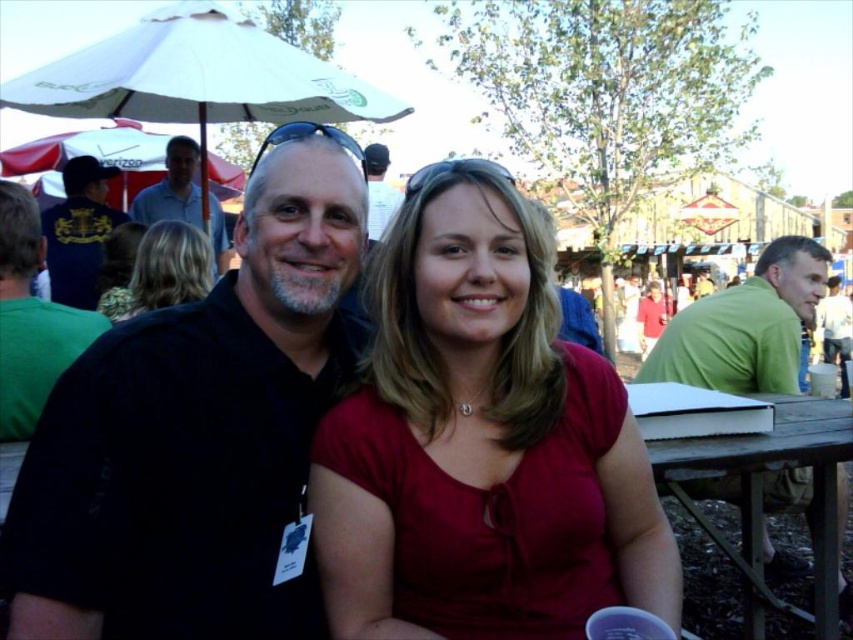
From the picture: You are at a community event and see two people in the distance. One is wearing a light blue shirt at upper left and the other is wearing a matte black shirt at center. Which one is positioned more to the left side of the scene?

The light blue shirt at upper left is positioned more to the left side of the scene compared to the matte black shirt at center.

You are organizing a photo shoot and need to place two models in the scene. The first model is wearing a light blue shirt at upper left, and the second is wearing a matte black shirt at center. If you want to ensure both models are visible in the frame, which model should you position closer to the camera to maintain their visibility?

The light blue shirt at upper left should be positioned closer to the camera because its width is larger than the matte black shirt at center. This adjustment will help balance their sizes in the frame, ensuring both are visible.

You are standing at the point labeled point (189, 202) and want to move to the point labeled point (751, 344). Which direction should you move to get closer to the camera?

You should move towards point (751, 344) because it is closer to the camera than point (189, 202).